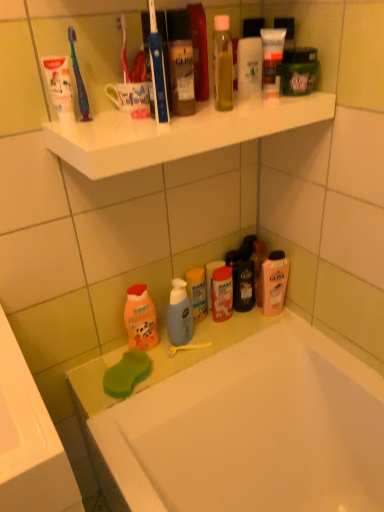
You are a GUI agent. You are given a task and a screenshot of the screen. Output one action in this format:
    pyautogui.click(x=<x>, y=<y>)
    Task: Click on the pink glossy mouthwash at lower right, the 2th mouthwash positioned from the front
    This screenshot has height=512, width=384.
    Given the screenshot: What is the action you would take?
    pyautogui.click(x=274, y=282)

Measure the distance between point (195, 315) and camera.

They are 4.31 feet apart.

How much space does translucent plastic shampoo bottle at lower center, which is the first toiletry in back-to-front order, occupy horizontally?

The width of translucent plastic shampoo bottle at lower center, which is the first toiletry in back-to-front order, is 1.92 inches.

What is the approximate width of shiny plastic bottle at upper center, the 3th toiletry in the bottom-to-top sequence?

It is 2.89 inches.

The width and height of the screenshot is (384, 512). I want to click on shiny plastic bottle at upper center, the 3th toiletry in the bottom-to-top sequence, so (x=181, y=62).

How much space does multicolored plastic toothbrush at upper left, the 1th toothbrush in the left-to-right sequence, occupy horizontally?

multicolored plastic toothbrush at upper left, the 1th toothbrush in the left-to-right sequence, is 2.62 inches in width.

Identify the location of green matte jar at upper right, which appears as the 1th mouthwash when viewed from the top. This screenshot has width=384, height=512. (298, 71).

In order to face blue plastic toothbrush at upper center, which appears as the first toothbrush when viewed from the right, should I rotate leftwards or rightwards?

Turn left by 4.835 degrees to look at blue plastic toothbrush at upper center, which appears as the first toothbrush when viewed from the right.

Find the location of `green sponge at lower left`. green sponge at lower left is located at coordinates (126, 374).

Relative to orange matte bottle at lower left, is green sponge at lower left in front or behind?

green sponge at lower left is in front of orange matte bottle at lower left.

From a real-world perspective, which is physically above, green sponge at lower left or orange matte bottle at lower left?

orange matte bottle at lower left is physically above.

In the scene shown: Is green sponge at lower left in contact with orange matte bottle at lower left?

No, green sponge at lower left is not touching orange matte bottle at lower left.

Between point (147, 361) and point (144, 317), which one is positioned behind?

Positioned behind is point (144, 317).

Can you confirm if green sponge at lower left is shorter than multicolored plastic toothbrush at upper left, the 1th toothbrush in the left-to-right sequence?

Indeed, green sponge at lower left has a lesser height compared to multicolored plastic toothbrush at upper left, the 1th toothbrush in the left-to-right sequence.

Is green sponge at lower left aimed at multicolored plastic toothbrush at upper left, the 1th toothbrush in the left-to-right sequence?

No, green sponge at lower left is not turned towards multicolored plastic toothbrush at upper left, the 1th toothbrush in the left-to-right sequence.

Would you say green sponge at lower left contains multicolored plastic toothbrush at upper left, which is the second toothbrush from right to left?

No, multicolored plastic toothbrush at upper left, which is the second toothbrush from right to left, is located outside of green sponge at lower left.

Which object is further away from the camera, white glossy shelf at upper center or translucent plastic shampoo bottle at lower center, which is the 4th toiletry from front to back?

translucent plastic shampoo bottle at lower center, which is the 4th toiletry from front to back, is behind.

Does white glossy shelf at upper center contain translucent plastic shampoo bottle at lower center, which is the first toiletry in back-to-front order?

Actually, translucent plastic shampoo bottle at lower center, which is the first toiletry in back-to-front order, is outside white glossy shelf at upper center.

Between point (108, 170) and point (188, 288), which one is positioned behind?

The point (188, 288) is farther from the camera.

Where is `toiletry that is the 1st one when counting rightward from the white glossy shelf at upper center`? The height and width of the screenshot is (512, 384). toiletry that is the 1st one when counting rightward from the white glossy shelf at upper center is located at coordinates (197, 292).

From a real-world perspective, is blue plastic toothbrush at upper center, which appears as the first toothbrush when viewed from the right, physically below white glossy bathtub at lower center?

Actually, blue plastic toothbrush at upper center, which appears as the first toothbrush when viewed from the right, is physically above white glossy bathtub at lower center in the real world.

Is blue plastic toothbrush at upper center, the 2th toothbrush from the left, not close to white glossy bathtub at lower center?

That's not correct — blue plastic toothbrush at upper center, the 2th toothbrush from the left, is a little close to white glossy bathtub at lower center.

Which is more to the left, blue plastic toothbrush at upper center, the 2th toothbrush from the left, or white glossy bathtub at lower center?

Positioned to the left is blue plastic toothbrush at upper center, the 2th toothbrush from the left.

Consider the image. Considering the relative sizes of blue plastic toothbrush at upper center, which appears as the first toothbrush when viewed from the right, and white glossy bathtub at lower center in the image provided, is blue plastic toothbrush at upper center, which appears as the first toothbrush when viewed from the right, taller than white glossy bathtub at lower center?

No.

Considering the sizes of objects shiny plastic bottle at upper center, the 3th toiletry in the bottom-to-top sequence, and green matte jar at upper right, which is the second mouthwash from bottom to top, in the image provided, who is smaller, shiny plastic bottle at upper center, the 3th toiletry in the bottom-to-top sequence, or green matte jar at upper right, which is the second mouthwash from bottom to top,?

green matte jar at upper right, which is the second mouthwash from bottom to top.

Can you confirm if shiny plastic bottle at upper center, the 3th toiletry in the bottom-to-top sequence, is wider than green matte jar at upper right, which appears as the 1th mouthwash when viewed from the top?

Correct, the width of shiny plastic bottle at upper center, the 3th toiletry in the bottom-to-top sequence, exceeds that of green matte jar at upper right, which appears as the 1th mouthwash when viewed from the top.

Identify the location of mouthwash that is the 1st object directly below the shiny plastic bottle at upper center, the 3th toiletry in the bottom-to-top sequence (from a real-world perspective). point(298,71).

Is shiny plastic bottle at upper center, the 3th toiletry in the bottom-to-top sequence, situated inside green matte jar at upper right, which appears as the 1th mouthwash when viewed from the top, or outside?

shiny plastic bottle at upper center, the 3th toiletry in the bottom-to-top sequence, is spatially situated outside green matte jar at upper right, which appears as the 1th mouthwash when viewed from the top.

Which is correct: green matte jar at upper right, which appears as the 1th mouthwash when viewed from the top, is inside matte plastic bottle at center, which is the third toiletry in top-to-bottom order, or outside of it?

The correct answer is: outside.

Considering the sizes of objects green matte jar at upper right, acting as the first mouthwash starting from the front, and matte plastic bottle at center, which is the third toiletry in top-to-bottom order, in the image provided, who is taller, green matte jar at upper right, acting as the first mouthwash starting from the front, or matte plastic bottle at center, which is the third toiletry in top-to-bottom order,?

With more height is matte plastic bottle at center, which is the third toiletry in top-to-bottom order.

Can you tell me how much green matte jar at upper right, which is the second mouthwash from bottom to top, and matte plastic bottle at center, which is the third toiletry in top-to-bottom order, differ in facing direction?

The angle between the facing direction of green matte jar at upper right, which is the second mouthwash from bottom to top, and the facing direction of matte plastic bottle at center, which is the third toiletry in top-to-bottom order, is 1.38 degrees.

Is green matte jar at upper right, acting as the first mouthwash starting from the front, not near matte plastic bottle at center, the second toiletry in the back-to-front sequence?

No.

Is blue plastic toothbrush at upper center, the 2th toothbrush from the left, taller or shorter than pink glossy mouthwash at lower right, the first mouthwash from the bottom?

blue plastic toothbrush at upper center, the 2th toothbrush from the left, is taller than pink glossy mouthwash at lower right, the first mouthwash from the bottom.

From the picture: Is there a large distance between blue plastic toothbrush at upper center, the 2th toothbrush from the left, and pink glossy mouthwash at lower right, which appears as the 1th mouthwash when viewed from the back?

No.

This screenshot has width=384, height=512. What are the coordinates of `the 2nd mouthwash behind the blue plastic toothbrush at upper center, the 2th toothbrush from the left` in the screenshot? It's located at (274, 282).

Where is `cleaning product on the right of green sponge at lower left`? cleaning product on the right of green sponge at lower left is located at coordinates (140, 319).

This screenshot has width=384, height=512. Find the location of `toothbrush that is on the left side of green sponge at lower left`. toothbrush that is on the left side of green sponge at lower left is located at coordinates (79, 79).

Considering their positions, is white glossy bathtub at lower center positioned further to white glossy shelf at upper center than blue plastic toothbrush at upper center, the 2th toothbrush from the left?

Based on the image, white glossy bathtub at lower center appears to be further to white glossy shelf at upper center.

Estimate the real-world distances between objects in this image. Which object is further from matte plastic bottle at center, acting as the 3th toiletry starting from the front, white glossy bathtub at lower center or pink glossy mouthwash at lower right, the first mouthwash from the bottom?

Among the two, white glossy bathtub at lower center is located further to matte plastic bottle at center, acting as the 3th toiletry starting from the front.

Estimate the real-world distances between objects in this image. Which object is closer to white glossy shelf at upper center, white glossy bathtub at lower center or translucent plastic shampoo bottle at lower center, which is the 4th toiletry from front to back?

translucent plastic shampoo bottle at lower center, which is the 4th toiletry from front to back.

Considering their positions, is shiny plastic bottle at upper center, the second toiletry from the top, positioned closer to matte plastic bottle at center, the second toiletry in the back-to-front sequence, than multicolored plastic toothbrush at upper left, the 1th toothbrush in the left-to-right sequence?

shiny plastic bottle at upper center, the second toiletry from the top, lies closer to matte plastic bottle at center, the second toiletry in the back-to-front sequence, than the other object.

Based on their spatial positions, is multicolored plastic toothbrush at upper left, which is the second toothbrush from right to left, or translucent plastic shampoo bottle at lower center, the 1th toiletry from the bottom, further from matte plastic bottle at center, the second toiletry in the back-to-front sequence?

The object further to matte plastic bottle at center, the second toiletry in the back-to-front sequence, is multicolored plastic toothbrush at upper left, which is the second toothbrush from right to left.

Which object lies nearer to the anchor point blue plastic toothbrush at upper center, which appears as the first toothbrush when viewed from the right, pink glossy mouthwash at lower right, the first mouthwash from the bottom, or green matte jar at upper right, which is the second mouthwash from bottom to top?

green matte jar at upper right, which is the second mouthwash from bottom to top, lies closer to blue plastic toothbrush at upper center, which appears as the first toothbrush when viewed from the right, than the other object.

In the scene shown: Looking at the image, which one is located closer to green matte jar at upper right, which appears as the 1th mouthwash when viewed from the top, orange matte bottle at lower left or matte plastic bottle at center, which is the third toiletry in top-to-bottom order?

Based on the image, matte plastic bottle at center, which is the third toiletry in top-to-bottom order, appears to be nearer to green matte jar at upper right, which appears as the 1th mouthwash when viewed from the top.

Which object lies nearer to the anchor point translucent plastic shampoo bottle at lower center, which is the 4th toiletry in top-to-bottom order, matte plastic bottle at center, the second toiletry in the back-to-front sequence, or pink glossy mouthwash at lower right, the first mouthwash from the bottom?

matte plastic bottle at center, the second toiletry in the back-to-front sequence, is positioned closer to the anchor translucent plastic shampoo bottle at lower center, which is the 4th toiletry in top-to-bottom order.

At what (x,y) coordinates should I click in order to perform the action: click on toothpaste that lies between white matte tube at upper center, the third toiletry from the back, and white glossy bathtub at lower center from top to bottom. Please return your answer as a coordinate pair (x, y). Looking at the image, I should click on (60, 86).

Locate an element on the screen. The height and width of the screenshot is (512, 384). mouthwash between shiny plastic bottle at upper center, the fourth toiletry positioned from the back, and translucent plastic shampoo bottle at lower center, which is the 4th toiletry from front to back, vertically is located at coordinates (274, 282).

Locate an element on the screen. The image size is (384, 512). toothpaste between multicolored plastic toothbrush at upper left, the 1th toothbrush in the left-to-right sequence, and matte plastic bottle at center, the 2th toiletry positioned from the bottom, in the vertical direction is located at coordinates (60, 86).

This screenshot has height=512, width=384. I want to click on toothpaste between multicolored plastic toothbrush at upper left, which is the second toothbrush from right to left, and orange matte bottle at lower left from top to bottom, so click(x=60, y=86).